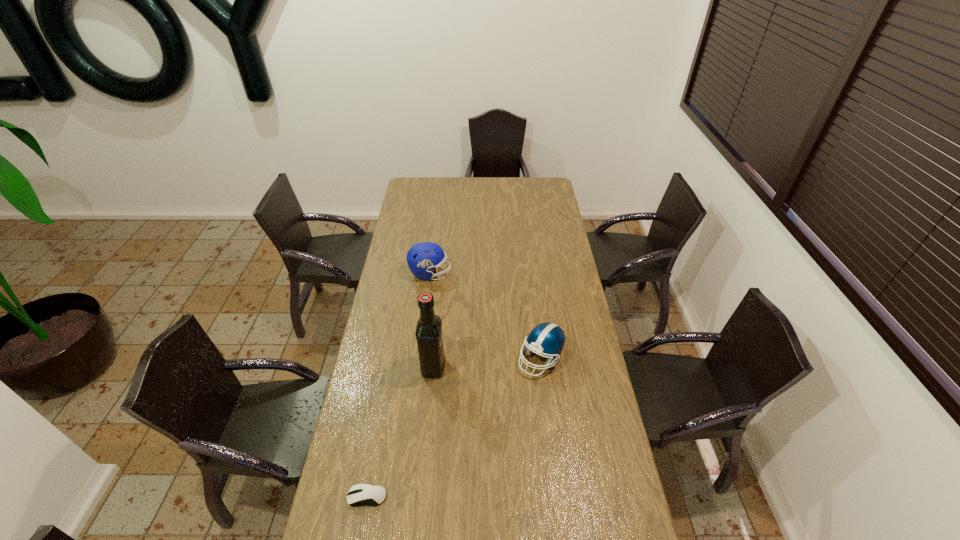
What are the coordinates of `vacant space that is in between the mouse and the nearer football helmet` in the screenshot? It's located at (454, 428).

Locate an element on the screen. Image resolution: width=960 pixels, height=540 pixels. blank region between the liquor and the right football helmet is located at coordinates (487, 363).

Locate an element on the screen. This screenshot has height=540, width=960. free point between the liquor and the rightmost object is located at coordinates (487, 363).

You are a GUI agent. You are given a task and a screenshot of the screen. Output one action in this format:
    pyautogui.click(x=<x>, y=<y>)
    Task: Click on the free point between the shortest object and the farthest object
    The width and height of the screenshot is (960, 540).
    Given the screenshot: What is the action you would take?
    pyautogui.click(x=398, y=385)

Find the location of a particular element. This screenshot has height=540, width=960. unoccupied area between the farther football helmet and the shortest object is located at coordinates click(398, 385).

Identify the location of unoccupied position between the nearer football helmet and the tallest object. The width and height of the screenshot is (960, 540). (487, 363).

Find the location of `vacant area that lies between the tallest object and the nearest object`. vacant area that lies between the tallest object and the nearest object is located at coordinates (400, 431).

Identify which object is located as the nearest to the right football helmet. Please provide its 2D coordinates. Your answer should be formatted as a tuple, i.e. [(x, y)], where the tuple contains the x and y coordinates of a point satisfying the conditions above.

[(428, 332)]

The height and width of the screenshot is (540, 960). What are the coordinates of `the second closest object to the tallest object` in the screenshot? It's located at (359, 494).

Where is `free location that satisfies the following two spatial constraints: 1. on the front-facing side of the tallest object; 2. on the front side of the mouse`? The height and width of the screenshot is (540, 960). free location that satisfies the following two spatial constraints: 1. on the front-facing side of the tallest object; 2. on the front side of the mouse is located at coordinates (420, 496).